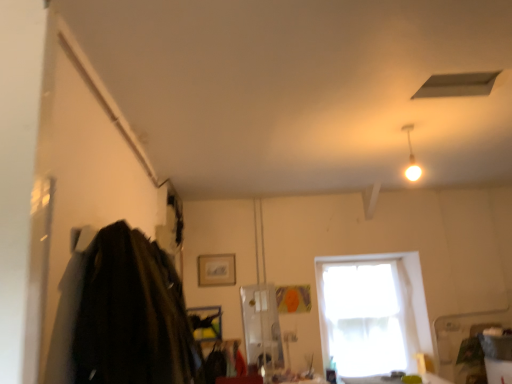
Question: Does dark wool coat at left lie in front of white glossy light fixture at upper right?

Choices:
 (A) yes
 (B) no

Answer: (A)

Question: Considering the relative sizes of dark wool coat at left and white glossy light fixture at upper right in the image provided, is dark wool coat at left shorter than white glossy light fixture at upper right?

Choices:
 (A) no
 (B) yes

Answer: (A)

Question: From a real-world perspective, is dark wool coat at left positioned over white glossy light fixture at upper right based on gravity?

Choices:
 (A) no
 (B) yes

Answer: (A)

Question: Would you say dark wool coat at left is a long distance from white glossy light fixture at upper right?

Choices:
 (A) no
 (B) yes

Answer: (B)

Question: Considering the relative sizes of dark wool coat at left and white glossy light fixture at upper right in the image provided, is dark wool coat at left thinner than white glossy light fixture at upper right?

Choices:
 (A) yes
 (B) no

Answer: (B)

Question: From a real-world perspective, is matte white exhaust hood at upper center physically located above or below white glossy light fixture at upper right?

Choices:
 (A) below
 (B) above

Answer: (B)

Question: Is matte white exhaust hood at upper center in front of or behind white glossy light fixture at upper right in the image?

Choices:
 (A) behind
 (B) front

Answer: (B)

Question: Is matte white exhaust hood at upper center wider or thinner than white glossy light fixture at upper right?

Choices:
 (A) thin
 (B) wide

Answer: (B)

Question: Considering the positions of matte white exhaust hood at upper center and white glossy light fixture at upper right in the image, is matte white exhaust hood at upper center taller or shorter than white glossy light fixture at upper right?

Choices:
 (A) tall
 (B) short

Answer: (B)

Question: In the image, is dark wool coat at left positioned in front of or behind matte white exhaust hood at upper center?

Choices:
 (A) front
 (B) behind

Answer: (A)

Question: Based on their positions, is dark wool coat at left located to the left or right of matte white exhaust hood at upper center?

Choices:
 (A) right
 (B) left

Answer: (B)

Question: In terms of height, does dark wool coat at left look taller or shorter compared to matte white exhaust hood at upper center?

Choices:
 (A) tall
 (B) short

Answer: (A)

Question: Based on their sizes in the image, would you say dark wool coat at left is bigger or smaller than matte white exhaust hood at upper center?

Choices:
 (A) big
 (B) small

Answer: (A)

Question: Does point pos(406,170) appear closer or farther from the camera than point pos(84,281)?

Choices:
 (A) farther
 (B) closer

Answer: (A)

Question: In terms of size, does white glossy light fixture at upper right appear bigger or smaller than dark wool coat at left?

Choices:
 (A) small
 (B) big

Answer: (A)